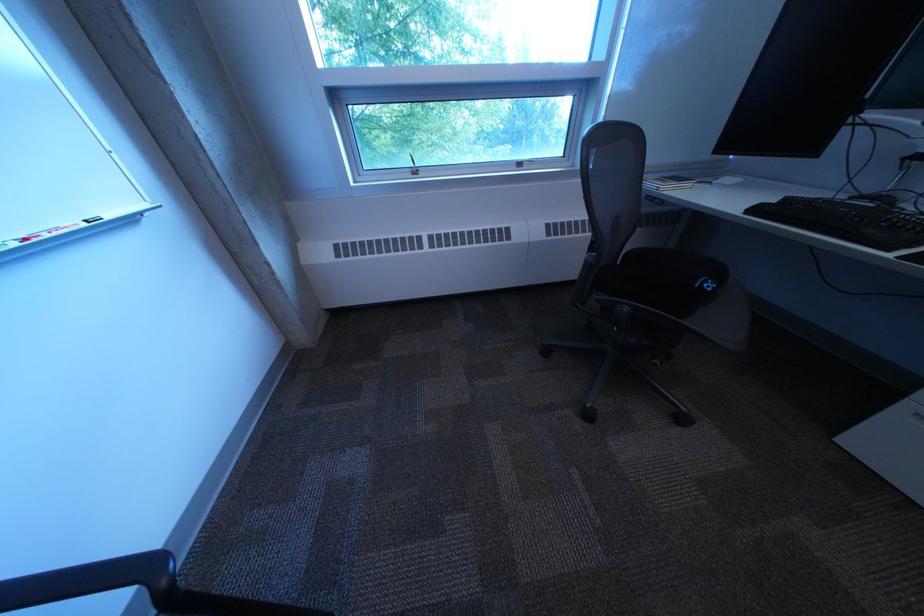
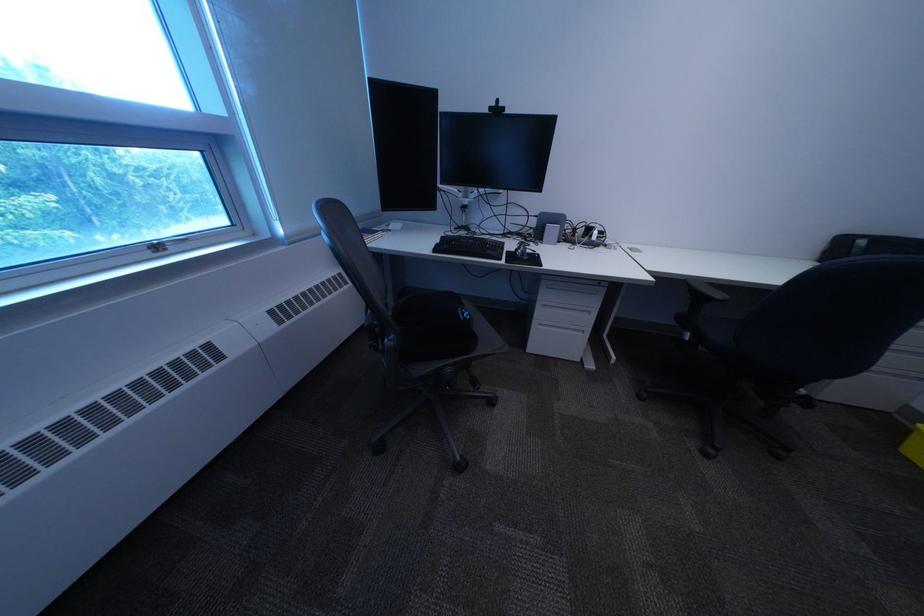
Question: The images are taken continuously from a first-person perspective. In which direction is your viewpoint rotating?

Choices:
 (A) Left
 (B) Right
 (C) Up
 (D) Down

Answer: (B)